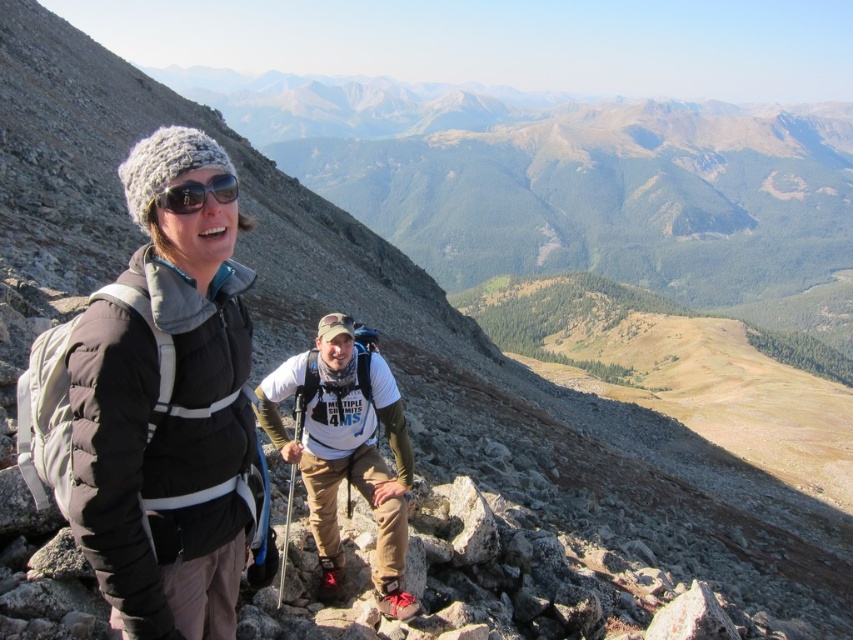
Based on the photo, who is higher up, matte black jacket at left or matte black sunglasses at upper left?

matte black sunglasses at upper left

Describe the element at coordinates (155, 410) in the screenshot. I see `matte black jacket at left` at that location.

Locate an element on the screen. The width and height of the screenshot is (853, 640). matte black jacket at left is located at coordinates (155, 410).

Which is in front, point (183, 611) or point (260, 381)?

Point (183, 611)

Consider the image. Can you confirm if matte black jacket at left is shorter than matte white t-shirt at center?

Incorrect, matte black jacket at left's height does not fall short of matte white t-shirt at center's.

Is point (209, 282) farther from viewer compared to point (390, 408)?

No, (209, 282) is in front of (390, 408).

Where is `matte black jacket at left`? The width and height of the screenshot is (853, 640). matte black jacket at left is located at coordinates (155, 410).

Is matte white t-shirt at center smaller than matte black sunglasses at upper left?

Incorrect, matte white t-shirt at center is not smaller in size than matte black sunglasses at upper left.

Describe the element at coordinates (345, 451) in the screenshot. This screenshot has width=853, height=640. I see `matte white t-shirt at center` at that location.

Is point (403, 449) in front of point (228, 188)?

No, (403, 449) is behind (228, 188).

The width and height of the screenshot is (853, 640). I want to click on matte white t-shirt at center, so click(345, 451).